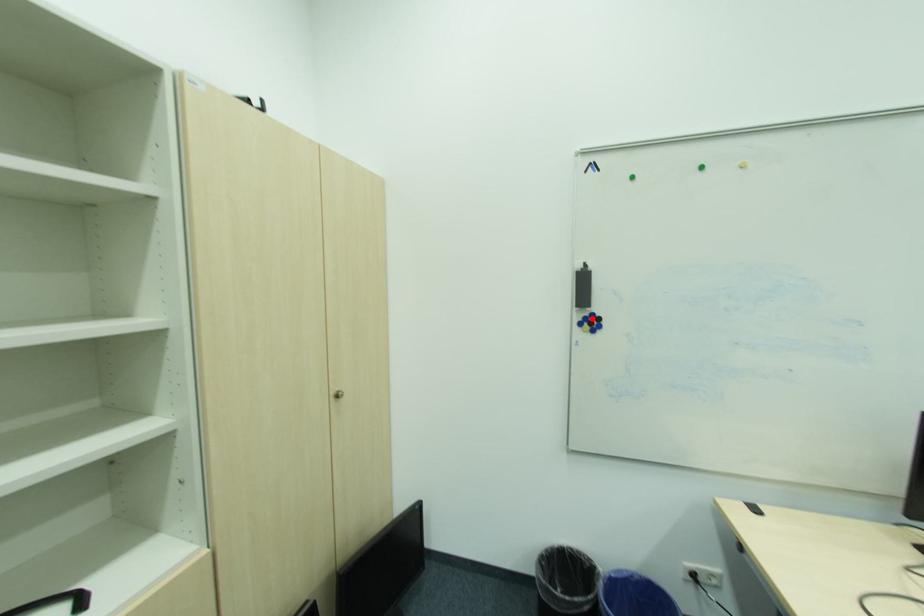
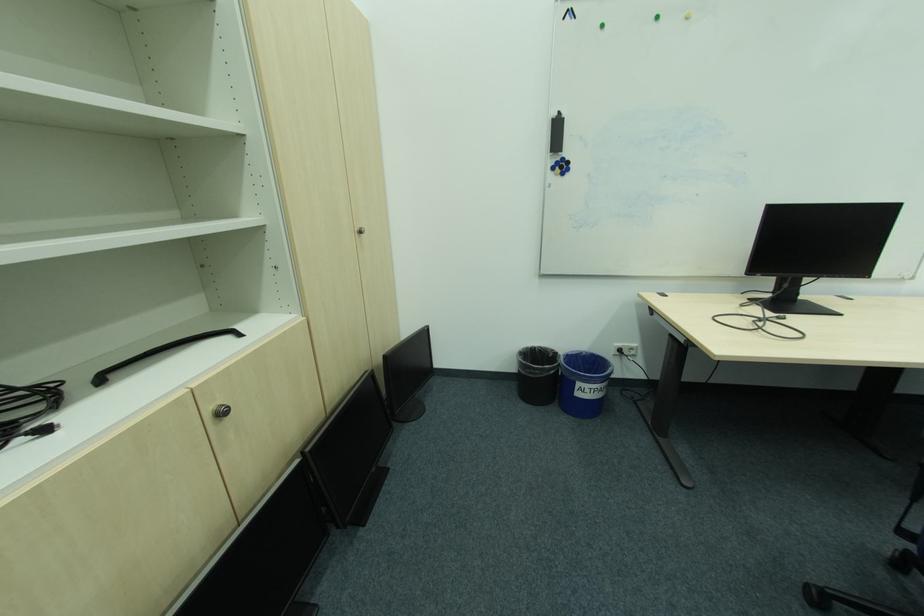
Find the pixel in the second image that matches the highlighted location in the first image.

(565, 163)